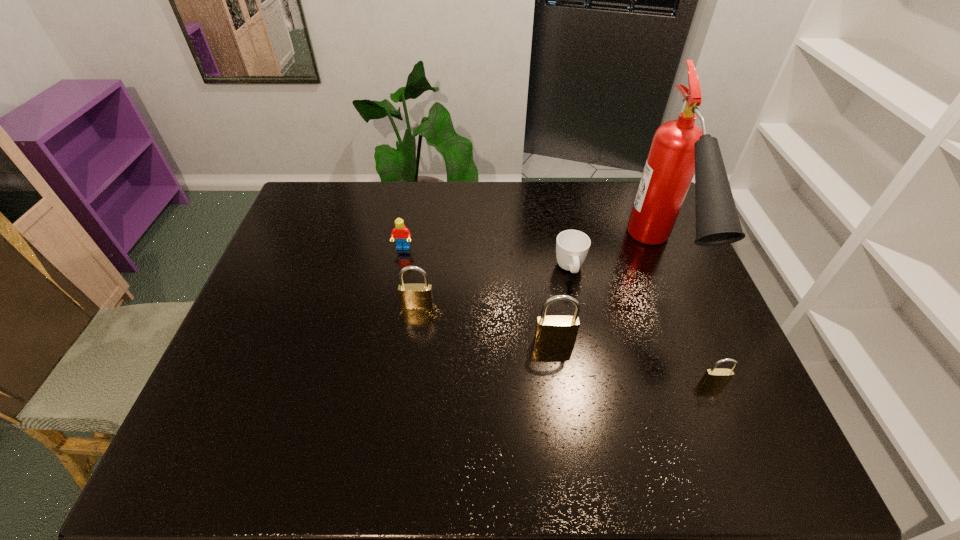
This screenshot has height=540, width=960. I want to click on free space that is in between the fifth farthest object and the cup, so click(562, 306).

You are a GUI agent. You are given a task and a screenshot of the screen. Output one action in this format:
    pyautogui.click(x=<x>, y=<y>)
    Task: Click on the empty space between the farthest padlock and the second nearest padlock
    
    Given the screenshot: What is the action you would take?
    pyautogui.click(x=486, y=323)

This screenshot has width=960, height=540. Identify the location of empty location between the Lego and the fourth shortest object. (410, 277).

Identify the location of vacant space that's between the Lego and the tallest object. The width and height of the screenshot is (960, 540). (531, 254).

Find the location of a particular element. empty space between the Lego and the second farthest padlock is located at coordinates (479, 295).

This screenshot has height=540, width=960. Identify the location of free space between the fifth farthest object and the farthest padlock. (486, 323).

Select which object appears as the fourth closest to the shortest padlock. Please provide its 2D coordinates. Your answer should be formatted as a tuple, i.e. [(x, y)], where the tuple contains the x and y coordinates of a point satisfying the conditions above.

[(412, 296)]

You are a GUI agent. You are given a task and a screenshot of the screen. Output one action in this format:
    pyautogui.click(x=<x>, y=<y>)
    Task: Click on the fifth closest object to the second farthest padlock
    The height and width of the screenshot is (540, 960).
    Given the screenshot: What is the action you would take?
    [x=401, y=234]

Where is `padlock that is the closest one to the farthest padlock`? padlock that is the closest one to the farthest padlock is located at coordinates (553, 330).

Locate an element on the screen. padlock that is the nearest to the cup is located at coordinates coord(553,330).